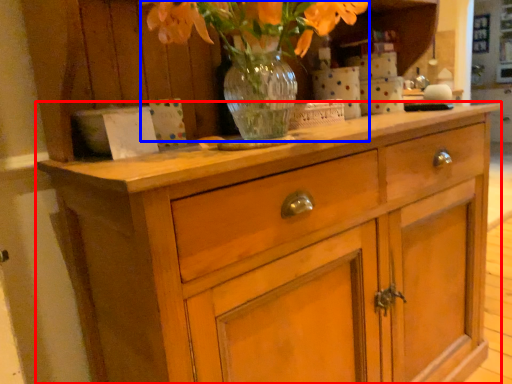
Question: Which object is further to the camera taking this photo, chest of drawers (highlighted by a red box) or floral arrangement (highlighted by a blue box)?

Choices:
 (A) chest of drawers
 (B) floral arrangement

Answer: (B)